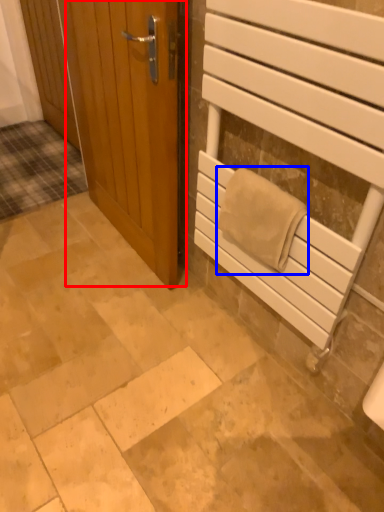
Question: Which object is further to the camera taking this photo, door (highlighted by a red box) or bath towel (highlighted by a blue box)?

Choices:
 (A) door
 (B) bath towel

Answer: (A)